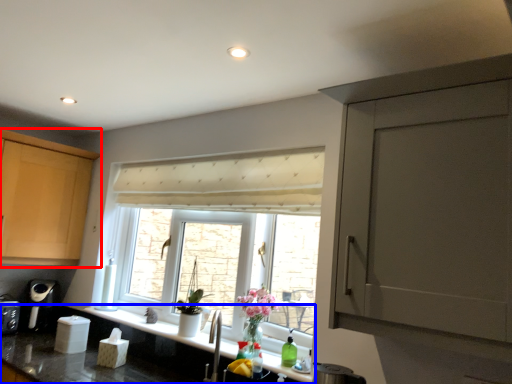
Question: Among these objects, which one is nearest to the camera, cabinetry (highlighted by a red box) or countertop (highlighted by a blue box)?

Choices:
 (A) cabinetry
 (B) countertop

Answer: (B)